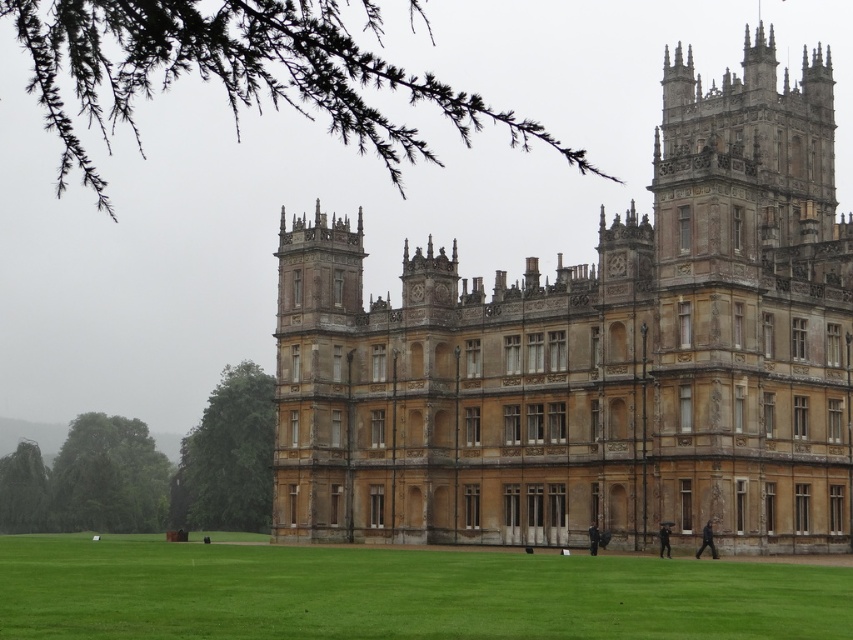
You are standing in front of the golden stone castle at center and looking towards the dark gray fabric coat at lower right. Which object is higher in elevation?

The golden stone castle at center is higher in elevation than the dark gray fabric coat at lower right because it is positioned above it in the image.

You are a photographer planning to take a picture of the grand historic building. You have two outfits to choose from for the shoot. The first is the dark gray suit at lower right, and the second is the dark blue fabric coat at lower center. If you want to ensure that your outfit does not block the view of the central tower, which outfit should you wear?

You should choose the dark blue fabric coat at lower center because it is narrower than the dark gray suit at lower right, reducing the chance of blocking the central tower.